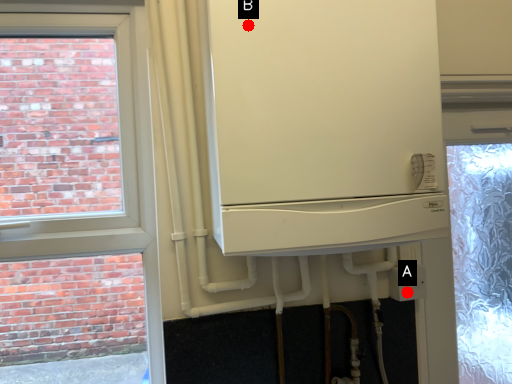
Question: Two points are circled on the image, labeled by A and B beside each circle. Among these points, which one is farthest from the camera?

Choices:
 (A) A is further
 (B) B is further

Answer: (A)